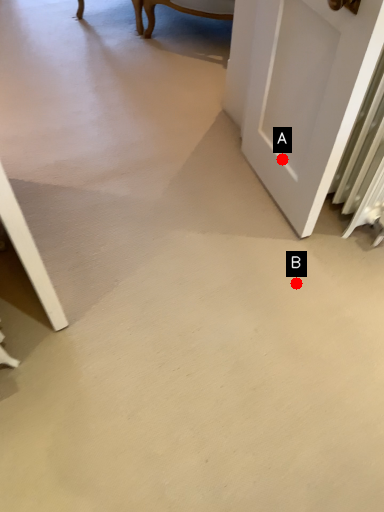
Question: Two points are circled on the image, labeled by A and B beside each circle. Which point is farther to the camera?

Choices:
 (A) A is further
 (B) B is further

Answer: (A)